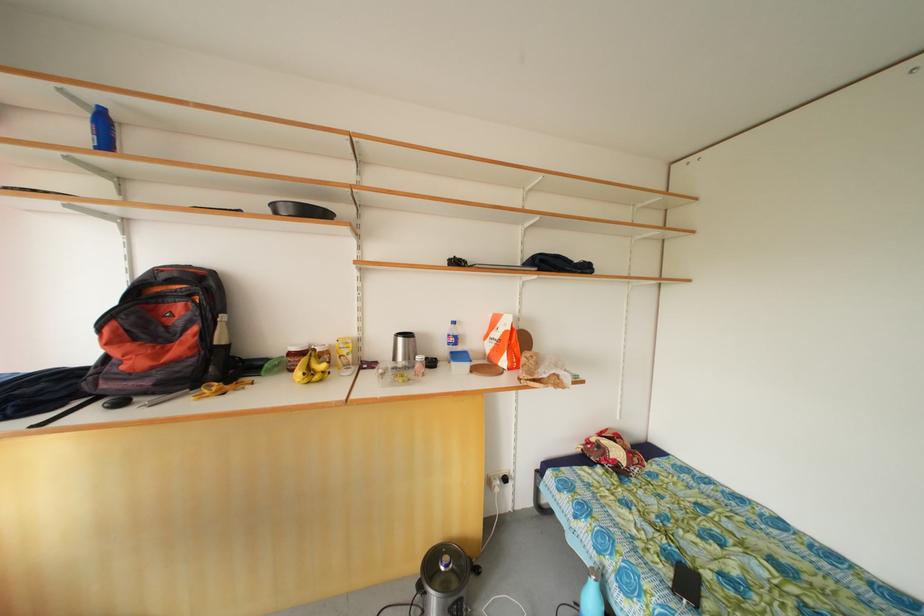
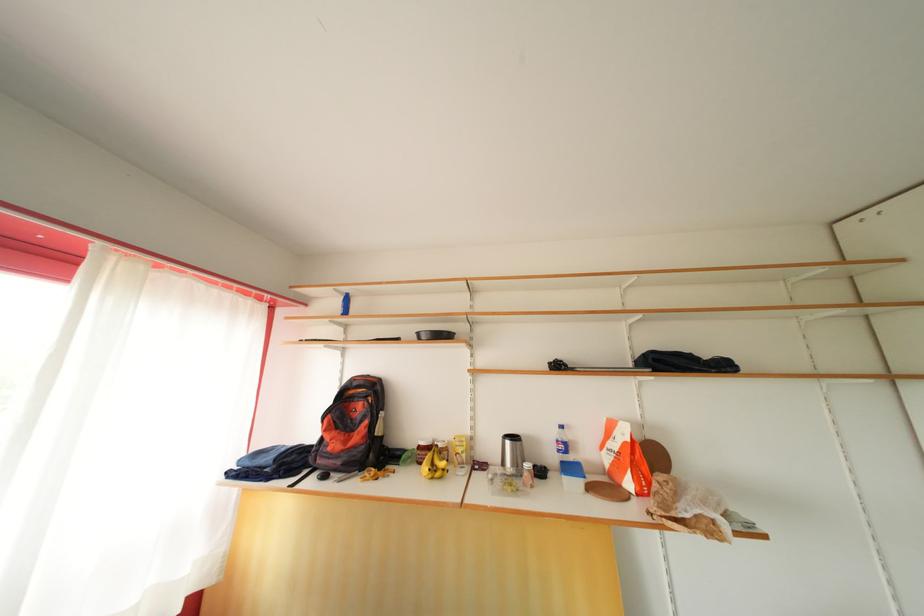
The point at (504,341) is marked in the first image. Where is the corresponding point in the second image?

(622, 451)